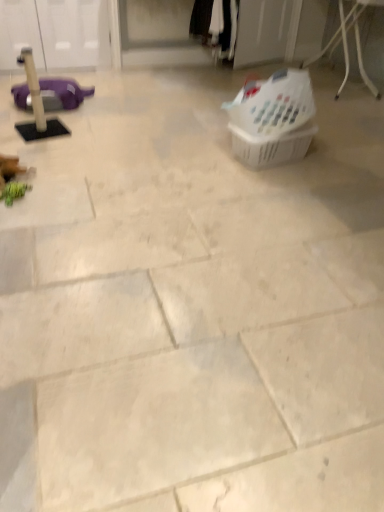
Question: Can you confirm if white plastic laundry basket at upper right, acting as the 2th basket starting from the bottom, is wider than black cotton pants at upper center?

Choices:
 (A) no
 (B) yes

Answer: (B)

Question: Is white plastic laundry basket at upper right, the first basket viewed from the top, far away from black cotton pants at upper center?

Choices:
 (A) no
 (B) yes

Answer: (B)

Question: Can you confirm if white plastic laundry basket at upper right, the first basket viewed from the top, is bigger than black cotton pants at upper center?

Choices:
 (A) no
 (B) yes

Answer: (A)

Question: From the image's perspective, is white plastic laundry basket at upper right, the first basket viewed from the top, on black cotton pants at upper center?

Choices:
 (A) yes
 (B) no

Answer: (B)

Question: Is white plastic laundry basket at upper right, the first basket viewed from the top, beside black cotton pants at upper center?

Choices:
 (A) yes
 (B) no

Answer: (B)

Question: Can you confirm if white plastic laundry basket at upper right, acting as the 2th basket starting from the bottom, is shorter than black cotton pants at upper center?

Choices:
 (A) yes
 (B) no

Answer: (A)

Question: Is black cotton pants at upper center not near metallic wire basket at upper right?

Choices:
 (A) no
 (B) yes

Answer: (B)

Question: Does black cotton pants at upper center have a smaller size compared to metallic wire basket at upper right?

Choices:
 (A) yes
 (B) no

Answer: (A)

Question: Is black cotton pants at upper center oriented away from metallic wire basket at upper right?

Choices:
 (A) no
 (B) yes

Answer: (A)

Question: Is black cotton pants at upper center positioned beyond the bounds of metallic wire basket at upper right?

Choices:
 (A) yes
 (B) no

Answer: (A)

Question: Considering the relative sizes of black cotton pants at upper center and metallic wire basket at upper right in the image provided, is black cotton pants at upper center shorter than metallic wire basket at upper right?

Choices:
 (A) no
 (B) yes

Answer: (B)

Question: Does black cotton pants at upper center have a greater height compared to metallic wire basket at upper right?

Choices:
 (A) yes
 (B) no

Answer: (B)

Question: From a real-world perspective, is white plastic laundry basket at upper right, acting as the 2th basket starting from the bottom, on top of metallic wire basket at upper right?

Choices:
 (A) yes
 (B) no

Answer: (A)